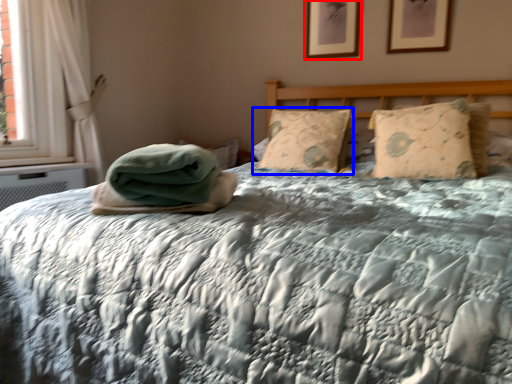
Question: Which of the following is the closest to the observer, picture frame (highlighted by a red box) or pillow (highlighted by a blue box)?

Choices:
 (A) picture frame
 (B) pillow

Answer: (B)